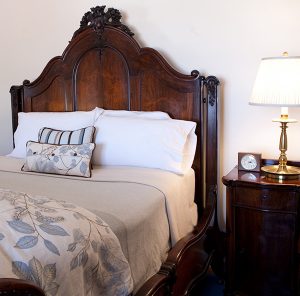
You are a GUI agent. You are given a task and a screenshot of the screen. Output one action in this format:
    pyautogui.click(x=<x>, y=<y>)
    Task: Click on the lamp
    This screenshot has height=296, width=300.
    Given the screenshot: What is the action you would take?
    pyautogui.click(x=280, y=156)